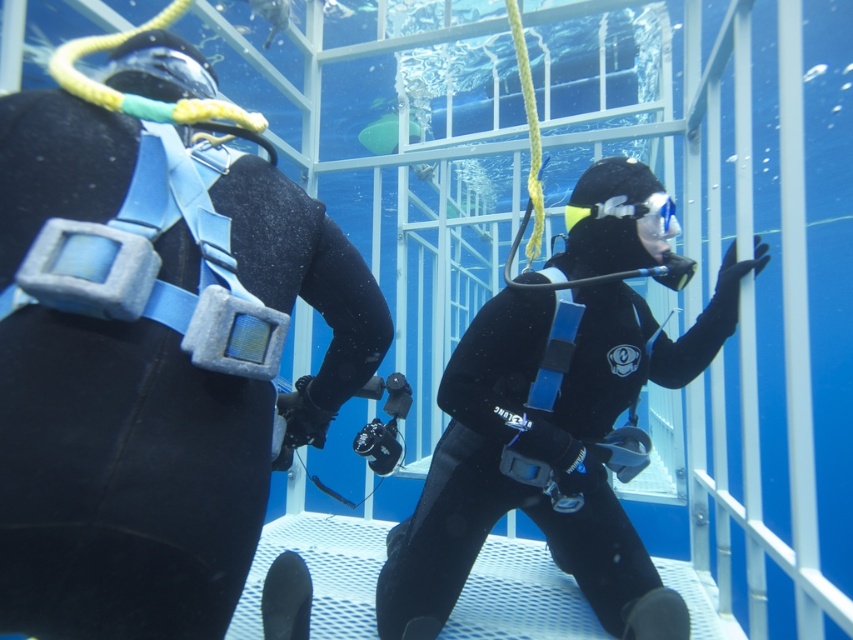
You are a scuba diving instructor preparing to check the equipment of two divers. You notice the black matte wetsuit at center and the clear plastic goggles at center. Which piece of equipment is bigger?

The black matte wetsuit at center is larger in size than the clear plastic goggles at center.

You are a safety inspector checking the underwater cage setup. You notice the black matte wetsuit at left and the clear plastic goggles at center. According to safety protocols, all equipment must be visible to the supervisor at all times. Does the positioning of these items comply with the requirement?

The black matte wetsuit at left is located below the clear plastic goggles at center. Since the goggles are positioned above the wetsuit, the supervisor can see both items, so the positioning complies with the requirement.

Consider the image. You are a scuba diving instructor observing two students in an underwater cage. You notice the black matte wetsuit at left and the black matte wetsuit at center. Which student is closer to the cage entrance?

The black matte wetsuit at left is in front of the black matte wetsuit at center, so the student in the black matte wetsuit at left is closer to the cage entrance.